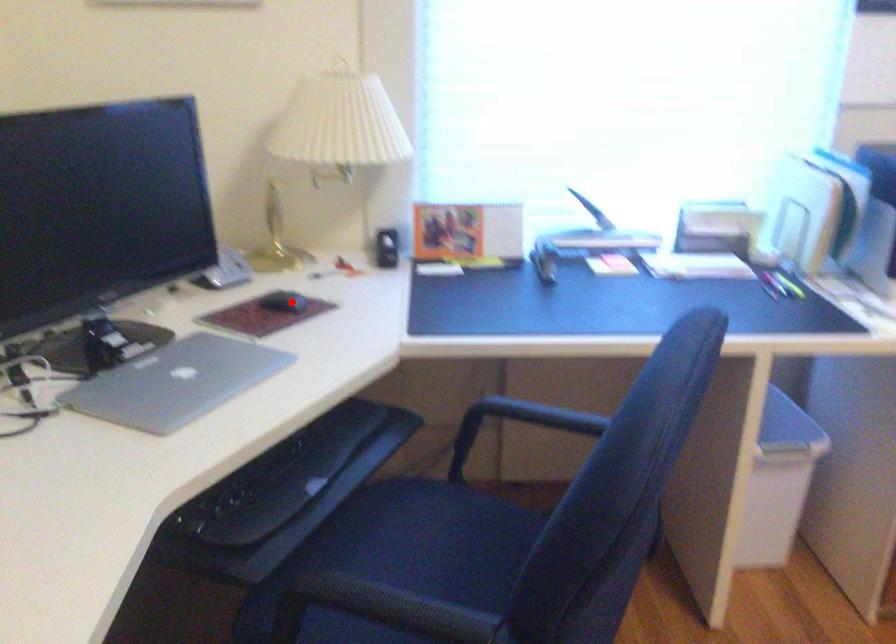
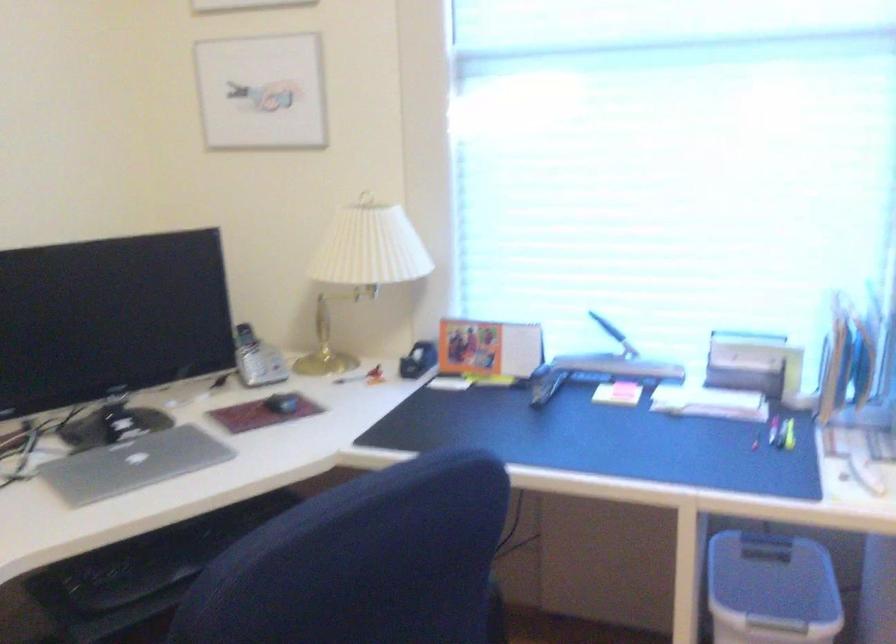
Question: I am providing you with two images of the same scene from different viewpoints. Image1 has a red point marked. In image2, the corresponding 3D location appears at what relative position? Reply with the corresponding letter.

Choices:
 (A) Closer
 (B) Farther

Answer: (B)